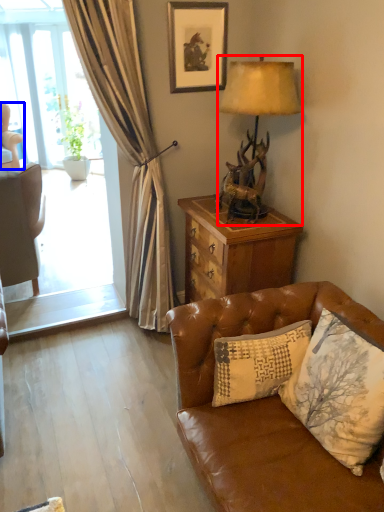
Question: Which of the following is the farthest to the observer, lamp (highlighted by a red box) or chair (highlighted by a blue box)?

Choices:
 (A) lamp
 (B) chair

Answer: (B)